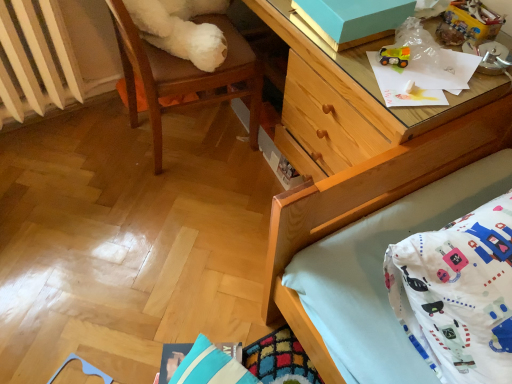
Question: Can rubberized yellow toy truck at upper right, the second toy in the right-to-left sequence, be found inside plastic toy car at upper right, positioned as the second toy in left-to-right order?

Choices:
 (A) yes
 (B) no

Answer: (B)

Question: Can you confirm if plastic toy car at upper right, the first toy from the right, is wider than rubberized yellow toy truck at upper right, the 1th toy from the bottom?

Choices:
 (A) no
 (B) yes

Answer: (B)

Question: Does plastic toy car at upper right, acting as the second toy starting from the bottom, appear on the left side of rubberized yellow toy truck at upper right, the second toy in the right-to-left sequence?

Choices:
 (A) yes
 (B) no

Answer: (B)

Question: From a real-world perspective, is plastic toy car at upper right, positioned as the second toy in left-to-right order, positioned over rubberized yellow toy truck at upper right, the second toy in the right-to-left sequence, based on gravity?

Choices:
 (A) no
 (B) yes

Answer: (B)

Question: Can you confirm if plastic toy car at upper right, acting as the second toy starting from the bottom, is smaller than rubberized yellow toy truck at upper right, the second toy in the right-to-left sequence?

Choices:
 (A) yes
 (B) no

Answer: (B)

Question: From the image's perspective, is matte blue cardboard box at upper right positioned above or below wooden desk at upper right?

Choices:
 (A) below
 (B) above

Answer: (B)

Question: Considering the positions of matte blue cardboard box at upper right and wooden desk at upper right in the image, is matte blue cardboard box at upper right wider or thinner than wooden desk at upper right?

Choices:
 (A) wide
 (B) thin

Answer: (B)

Question: From a real-world perspective, is matte blue cardboard box at upper right above or below wooden desk at upper right?

Choices:
 (A) below
 (B) above

Answer: (B)

Question: Is matte blue cardboard box at upper right inside or outside of wooden desk at upper right?

Choices:
 (A) outside
 (B) inside

Answer: (B)

Question: Is matte blue cardboard box at upper right to the left or to the right of white plastic radiator at left in the image?

Choices:
 (A) left
 (B) right

Answer: (B)

Question: Is matte blue cardboard box at upper right inside or outside of white plastic radiator at left?

Choices:
 (A) outside
 (B) inside

Answer: (A)

Question: Does point (362, 36) appear closer or farther from the camera than point (68, 72)?

Choices:
 (A) farther
 (B) closer

Answer: (B)

Question: From the image's perspective, is matte blue cardboard box at upper right above or below white plastic radiator at left?

Choices:
 (A) above
 (B) below

Answer: (B)

Question: Considering their positions, is wooden desk at upper right located in front of or behind rubberized yellow toy truck at upper right, acting as the 2th toy starting from the top?

Choices:
 (A) behind
 (B) front

Answer: (B)

Question: From a real-world perspective, is wooden desk at upper right physically located above or below rubberized yellow toy truck at upper right, the first toy positioned from the left?

Choices:
 (A) below
 (B) above

Answer: (A)